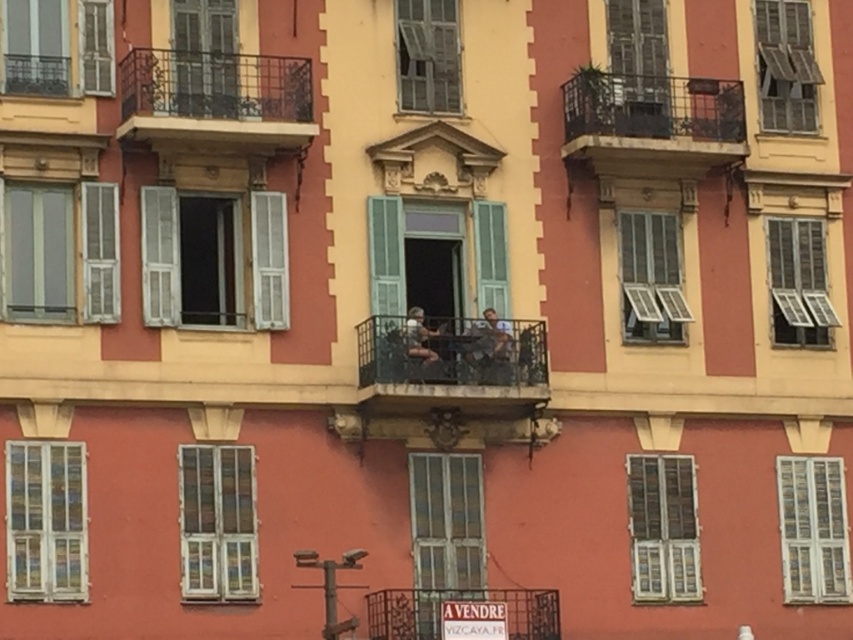
You are an architect designing a new building and want to ensure that the rustic metal balcony at upper right and the metallic gray window at upper center align properly. Based on the image, which of these two elements has a smaller width?

The rustic metal balcony at upper right has a smaller width than the metallic gray window at upper center.

You are an architect evaluating the building facade. You need to determine if the rustic metal balcony at upper right can fit within the space allocated for the metallic gray window at upper center. Based on their sizes, is this possible?

The rustic metal balcony at upper right is smaller than the metallic gray window at upper center, so it can fit within the space allocated for the metallic gray window at upper center.

You are a painter standing on the ground floor of the building and need to reach the rustic metal balcony at upper right. The ladder you have is 6 meters long. Can you safely reach it with your ladder?

The distance between the ground floor and the rustic metal balcony at upper right is 67.79 meters, which is much greater than the ladder length of 6 meters. Therefore, the ladder is too short to safely reach the balcony.